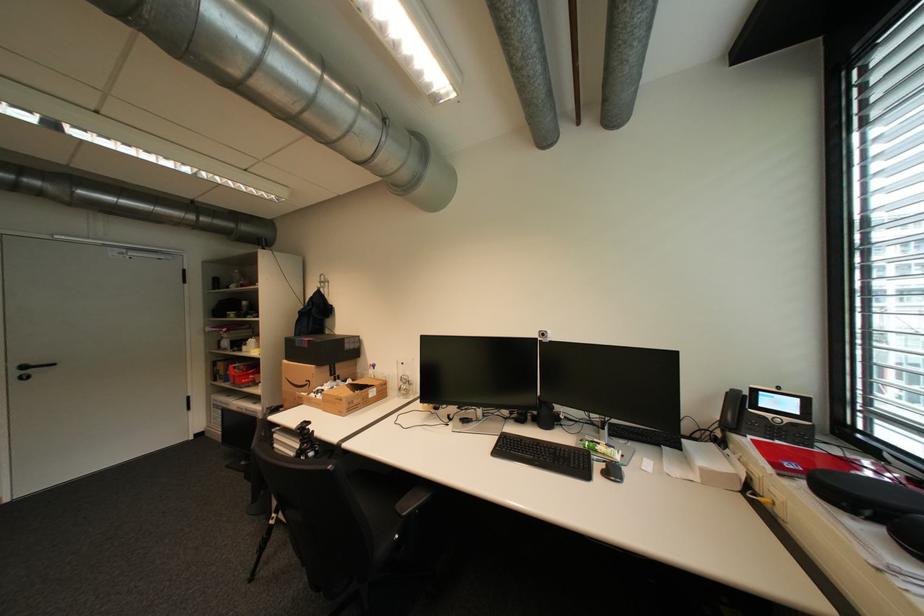
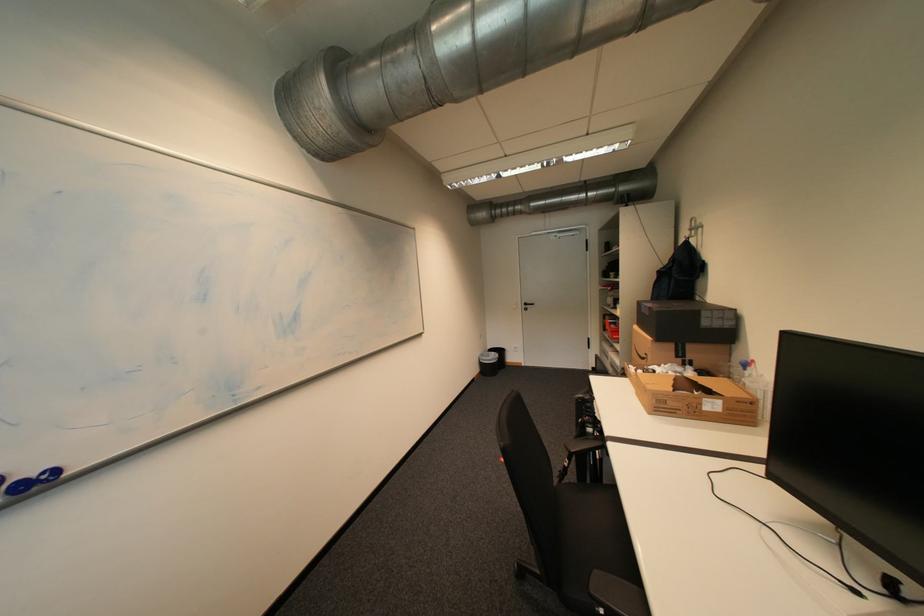
Question: How did the camera likely rotate?

Choices:
 (A) Left
 (B) Right
 (C) Up
 (D) Down

Answer: (A)